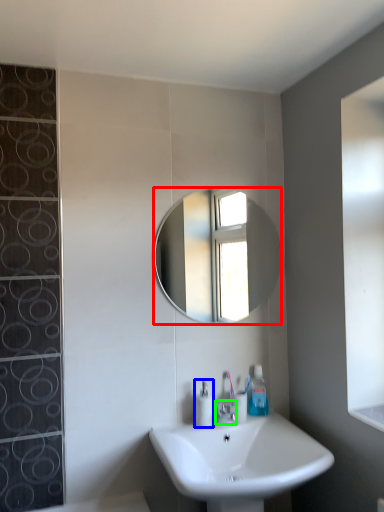
Question: Based on their relative distances, which object is farther from mirror (highlighted by a red box)? Choose from soap dispenser (highlighted by a blue box) and tap (highlighted by a green box).

Choices:
 (A) soap dispenser
 (B) tap

Answer: (B)